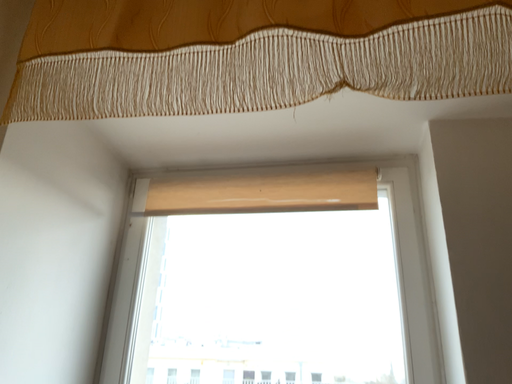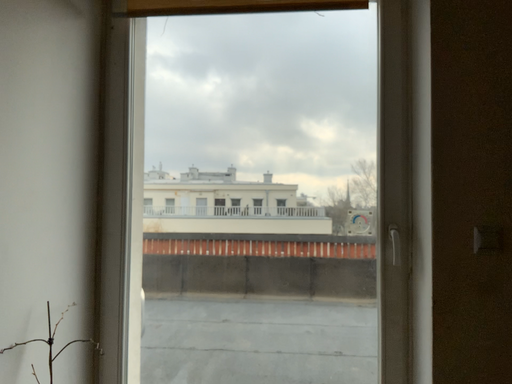
Question: How did the camera likely rotate when shooting the video?

Choices:
 (A) rotated upward
 (B) rotated downward

Answer: (B)